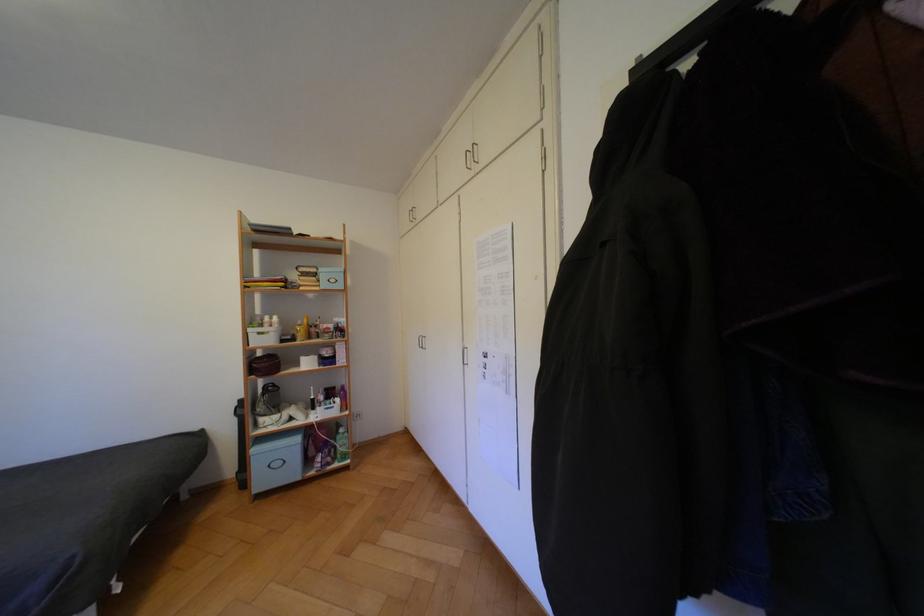
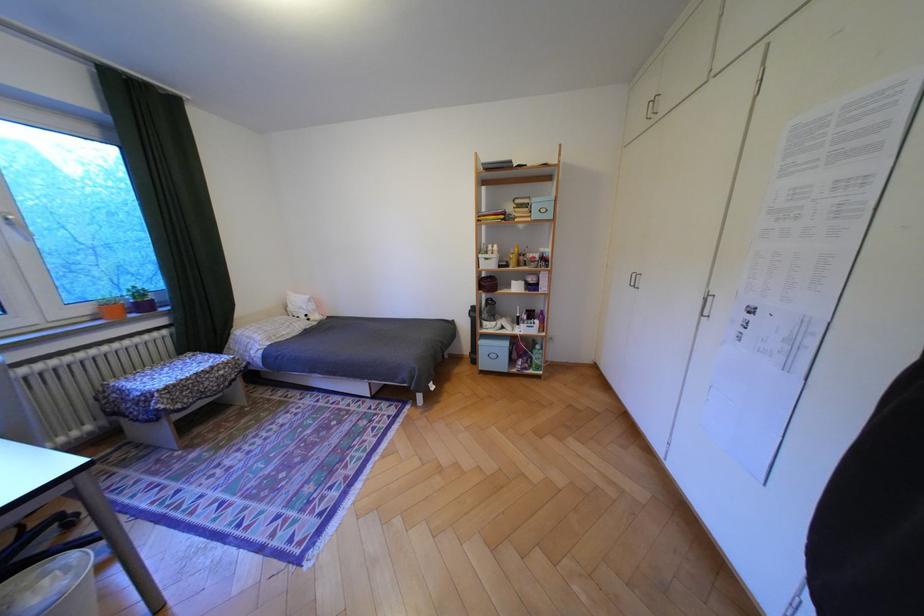
The point at (261,330) is marked in the first image. Where is the corresponding point in the second image?

(492, 256)